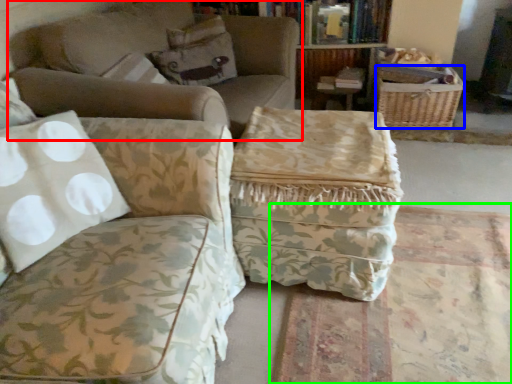
Question: Based on their relative distances, which object is farther from studio couch (highlighted by a red box)? Choose from basket (highlighted by a blue box) and mat (highlighted by a green box).

Choices:
 (A) basket
 (B) mat

Answer: (A)